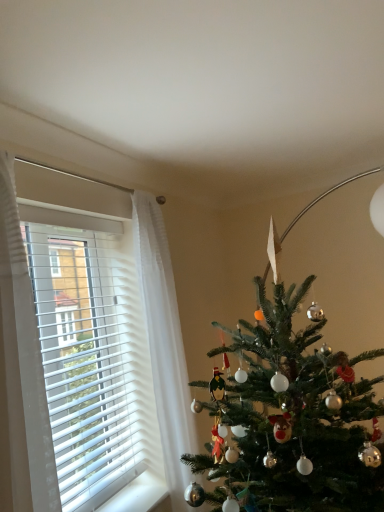
Question: Choose the correct answer: Is green matte christmas tree at right inside green matte christmas tree at center or outside it?

Choices:
 (A) outside
 (B) inside

Answer: (A)

Question: Considering their positions, is green matte christmas tree at right located in front of or behind green matte christmas tree at center?

Choices:
 (A) front
 (B) behind

Answer: (A)

Question: Considering the real-world distances, which object is farthest from the white blinds at left?

Choices:
 (A) green matte christmas tree at center
 (B) green matte christmas tree at right

Answer: (B)

Question: Considering the real-world distances, which object is farthest from the green matte christmas tree at right?

Choices:
 (A) white blinds at left
 (B) green matte christmas tree at center

Answer: (A)